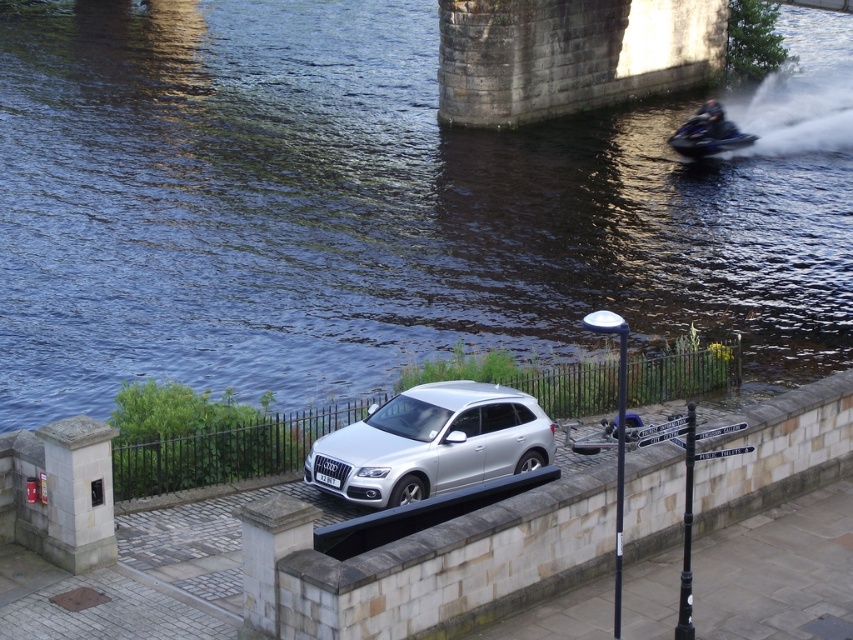
You are planning to transport both the satin silver suv at center and the blue metallic jet ski at upper right onto a trailer. The trailer can only carry one vehicle at a time. Based on their sizes, which vehicle should you load first to ensure the trailer can accommodate both trips?

The satin silver suv at center is bigger than the blue metallic jet ski at upper right. Therefore, you should load the satin silver suv at center first to ensure it fits on the trailer, then the blue metallic jet ski at upper right can be transported in the second trip.